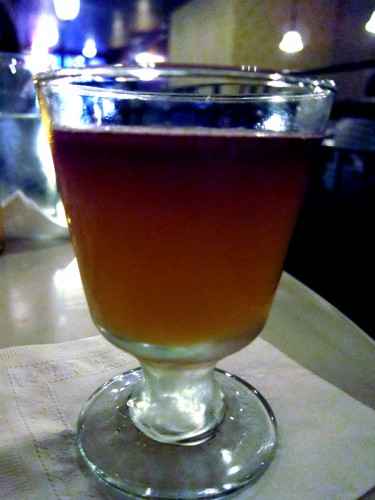
Where is `base of glass`? This screenshot has width=375, height=500. base of glass is located at coordinates (208, 457).